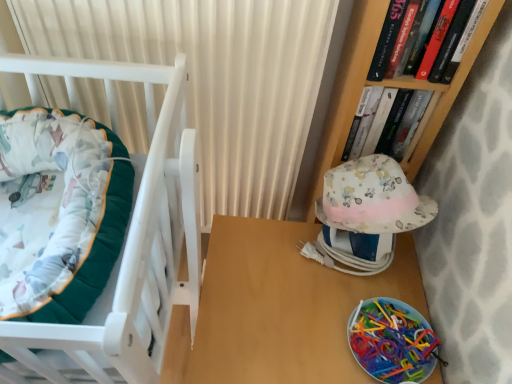
Question: Should I look upward or downward to see wooden table at center?

Choices:
 (A) down
 (B) up

Answer: (A)

Question: Is hardcover book at upper right, the second book positioned from the front, smaller than wooden table at center?

Choices:
 (A) yes
 (B) no

Answer: (A)

Question: Is hardcover book at upper right, marked as the first book in a back-to-front arrangement, to the left of wooden table at center from the viewer's perspective?

Choices:
 (A) yes
 (B) no

Answer: (B)

Question: Does hardcover book at upper right, the second book positioned from the front, have a greater width compared to wooden table at center?

Choices:
 (A) yes
 (B) no

Answer: (B)

Question: Can you confirm if hardcover book at upper right, the second book positioned from the front, is thinner than wooden table at center?

Choices:
 (A) no
 (B) yes

Answer: (B)

Question: Does hardcover book at upper right, marked as the first book in a back-to-front arrangement, have a larger size compared to wooden table at center?

Choices:
 (A) yes
 (B) no

Answer: (B)

Question: Does hardcover book at upper right, marked as the first book in a back-to-front arrangement, come behind wooden table at center?

Choices:
 (A) no
 (B) yes

Answer: (B)

Question: From the image's perspective, would you say wooden table at center is shown under hardcover book at upper right, which ranks as the second book in back-to-front order?

Choices:
 (A) no
 (B) yes

Answer: (B)

Question: Can you confirm if wooden table at center is positioned to the right of hardcover book at upper right, which appears as the first book when viewed from the front?

Choices:
 (A) no
 (B) yes

Answer: (A)

Question: Is the position of wooden table at center more distant than that of hardcover book at upper right, which ranks as the second book in back-to-front order?

Choices:
 (A) yes
 (B) no

Answer: (A)

Question: Can you confirm if wooden table at center is shorter than hardcover book at upper right, which ranks as the second book in back-to-front order?

Choices:
 (A) no
 (B) yes

Answer: (A)

Question: Is hardcover book at upper right, which appears as the first book when viewed from the front, at the back of wooden table at center?

Choices:
 (A) yes
 (B) no

Answer: (B)

Question: Does wooden table at center have a greater width compared to hardcover book at upper right, which appears as the first book when viewed from the front?

Choices:
 (A) yes
 (B) no

Answer: (A)

Question: Can you confirm if hardcover book at upper right, the second book positioned from the front, is wider than hardcover book at upper right, which ranks as the second book in back-to-front order?

Choices:
 (A) yes
 (B) no

Answer: (A)